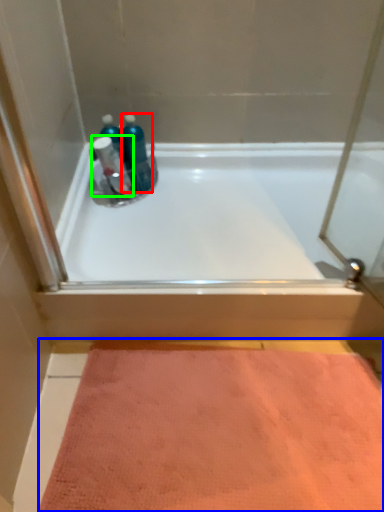
Question: Which object is the closest to the mouthwash (highlighted by a red box)? Choose among these: doormat (highlighted by a blue box) or cleaning product (highlighted by a green box).

Choices:
 (A) doormat
 (B) cleaning product

Answer: (B)